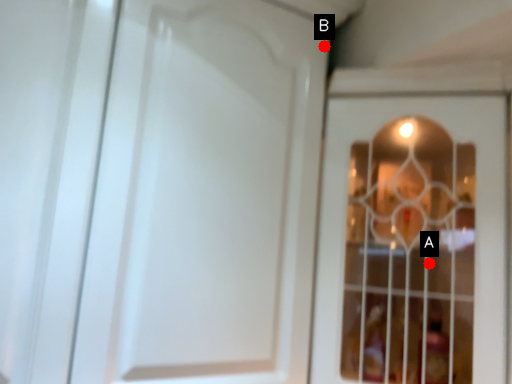
Question: Two points are circled on the image, labeled by A and B beside each circle. Which point is farther from the camera taking this photo?

Choices:
 (A) A is further
 (B) B is further

Answer: (B)